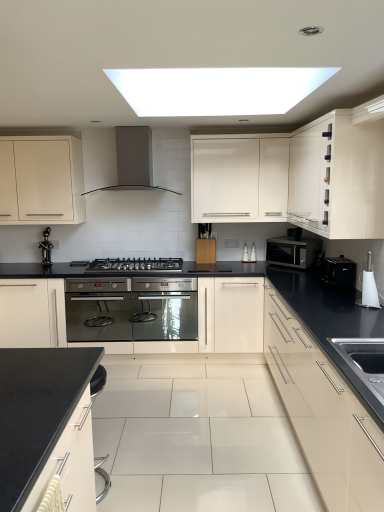
The height and width of the screenshot is (512, 384). Identify the location of blank space situated above black matte countertop at lower left, the second cabinetry from the left (from a real-world perspective). (31, 387).